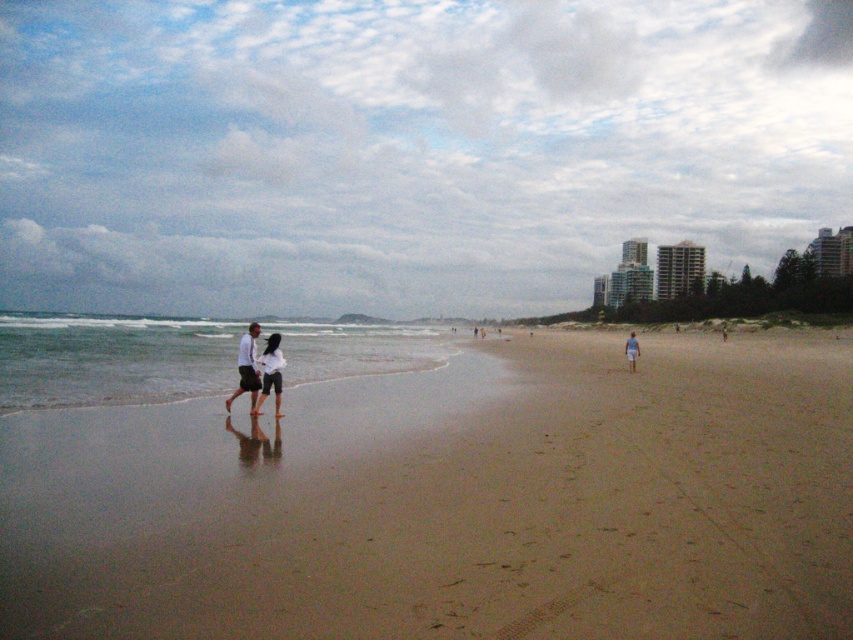
Question: Can you confirm if matte white shirt at center is smaller than white cotton shorts at center?

Choices:
 (A) yes
 (B) no

Answer: (B)

Question: Among these objects, which one is farthest from the camera?

Choices:
 (A) matte white shirt at center
 (B) white fabric shorts at center
 (C) brown sandy beach at center

Answer: (B)

Question: Is matte white shirt at center bigger than white fabric shorts at center?

Choices:
 (A) no
 (B) yes

Answer: (A)

Question: Can you confirm if brown sandy beach at center is positioned above white fabric shorts at center?

Choices:
 (A) no
 (B) yes

Answer: (A)

Question: Estimate the real-world distances between objects in this image. Which object is farther from the brown sandy beach at center?

Choices:
 (A) matte white shirt at center
 (B) white cotton shorts at center

Answer: (A)

Question: Which of the following is the farthest from the observer?

Choices:
 (A) (282, 416)
 (B) (254, 324)

Answer: (B)